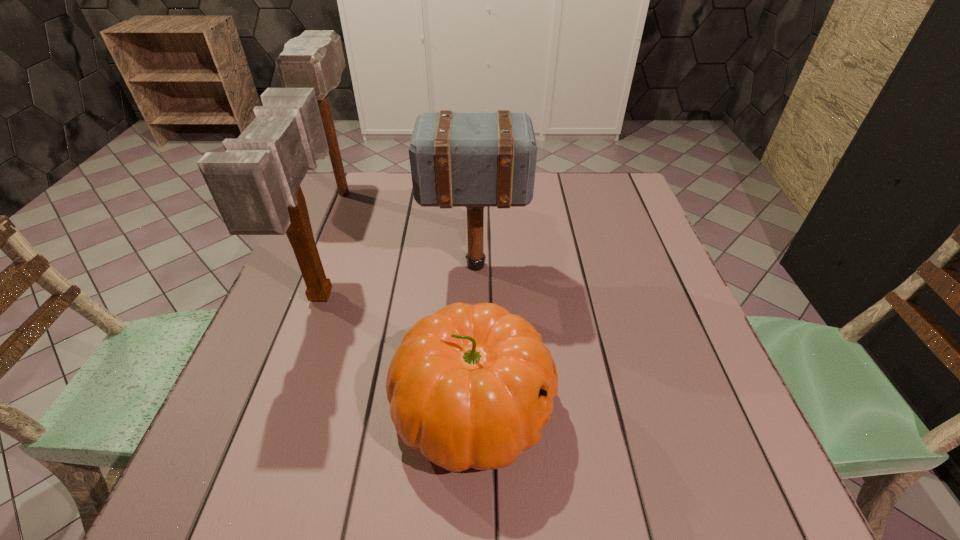
I want to click on the farthest object, so tap(315, 59).

The image size is (960, 540). Find the location of `the rightmost mallet`. the rightmost mallet is located at coordinates (458, 159).

Where is `the shortest object`? the shortest object is located at coordinates (471, 386).

Where is `vacant space located on the striking face of the farthest object`? The height and width of the screenshot is (540, 960). vacant space located on the striking face of the farthest object is located at coordinates (298, 305).

At what (x,y) coordinates should I click in order to perform the action: click on free spot located 0.280m on the striking surface of the rightmost mallet. Please return your answer as a coordinate pair (x, y). Looking at the image, I should click on (638, 265).

You are a GUI agent. You are given a task and a screenshot of the screen. Output one action in this format:
    pyautogui.click(x=<x>, y=<y>)
    Task: Click on the vacant space situated 0.080m on the carved face of the pumpkin
    
    Given the screenshot: What is the action you would take?
    pyautogui.click(x=597, y=407)

Where is `object that is at the far edge`? The width and height of the screenshot is (960, 540). object that is at the far edge is located at coordinates (315, 59).

Locate an element on the screen. object at the near edge is located at coordinates (471, 386).

Locate an element on the screen. This screenshot has height=540, width=960. object present at the far left corner is located at coordinates (315, 59).

You are a GUI agent. You are given a task and a screenshot of the screen. Output one action in this format:
    pyautogui.click(x=<x>, y=<y>)
    Task: Click on the vacant space at the far edge of the desktop
    The height and width of the screenshot is (540, 960).
    Given the screenshot: What is the action you would take?
    pyautogui.click(x=498, y=212)